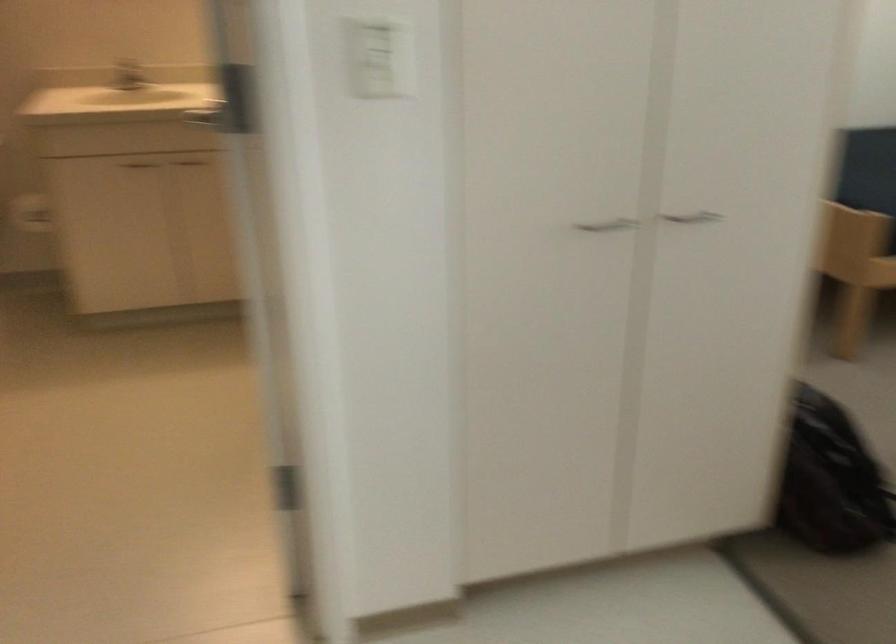
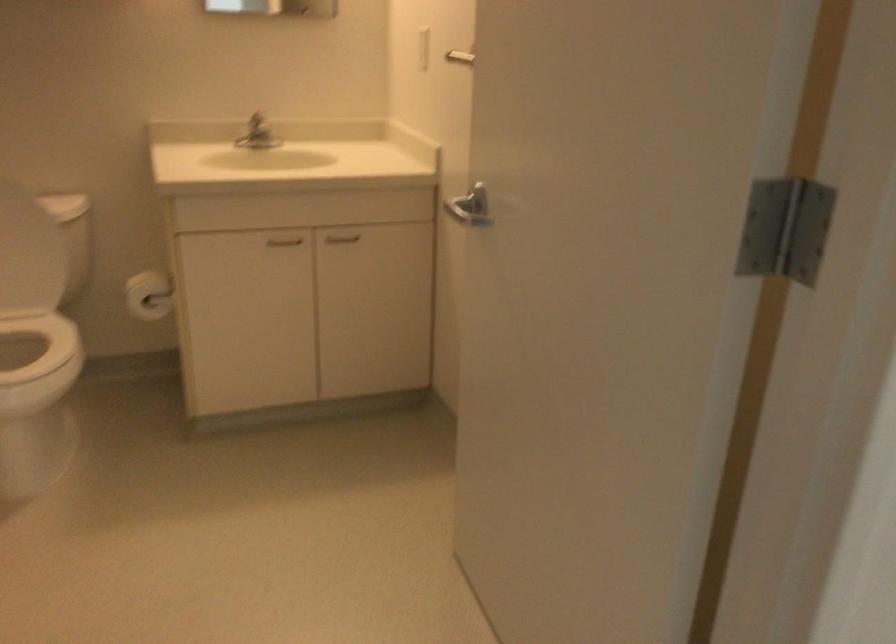
In the scene shown: Which direction would the cameraman need to move to produce the second image?

The cameraman moved toward left, forward.